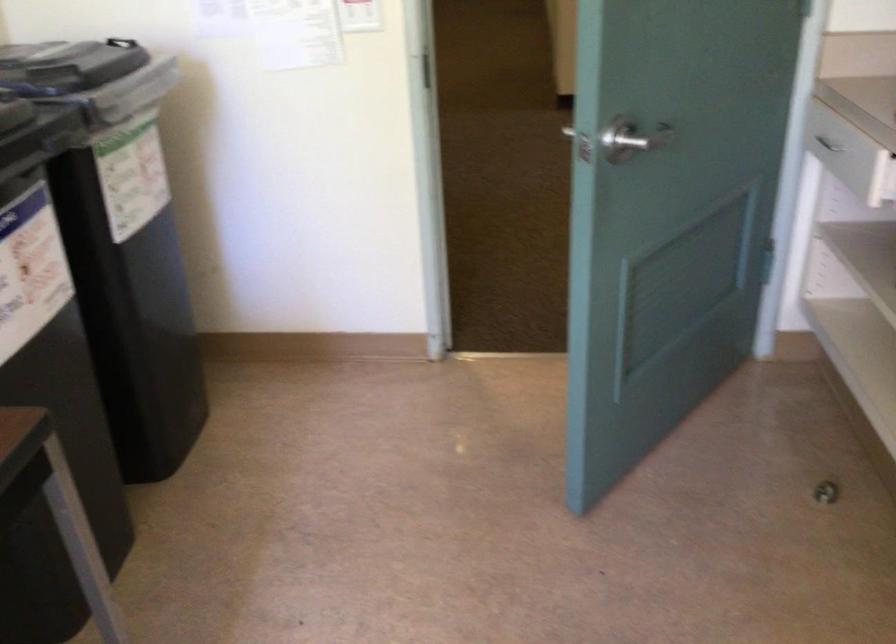
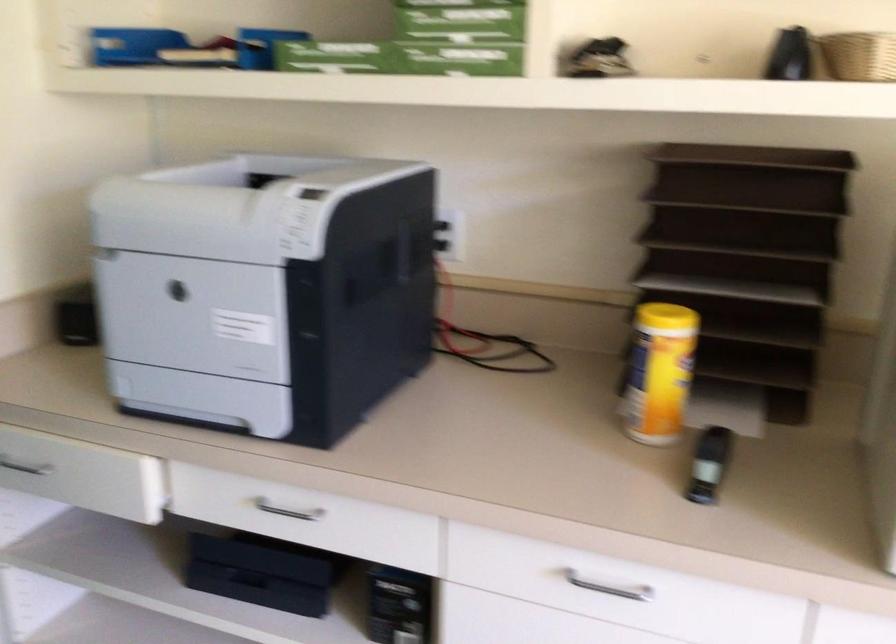
Question: How did the camera likely rotate?

Choices:
 (A) Left
 (B) Right
 (C) Up
 (D) Down

Answer: (B)